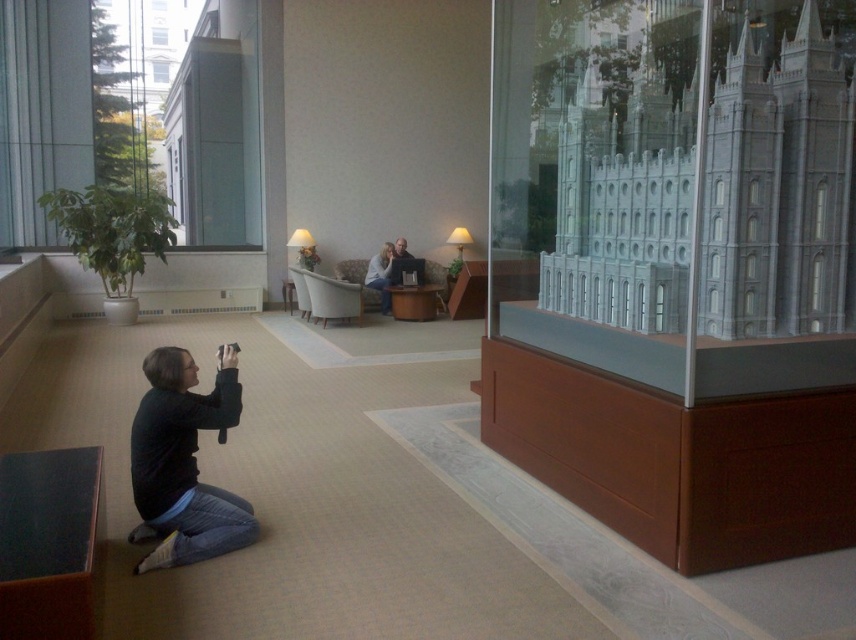
You are planning to place a new rug in the lobby. The rug you have is wider than the light brown leather couch at center. Can the rug fit in the space where the black fabric squat at lower left is currently located?

The black fabric squat at lower left has a larger width than the light brown leather couch at center. Since your rug is wider than the couch, it might still fit if the rug is not wider than the squat. However, without knowing the exact dimensions of the rug, it is uncertain. Please measure the space first.

You are a photographer who wants to take a photo of the light brown leather couch at center without the black fabric squat at lower left appearing in the frame. Based on their heights, is this possible?

The black fabric squat at lower left is shorter than the light brown leather couch at center, so if the photographer positions themselves to shoot from a higher angle or moves closer to the couch, they can frame the shot to exclude the squat since it is shorter and less likely to block the view.